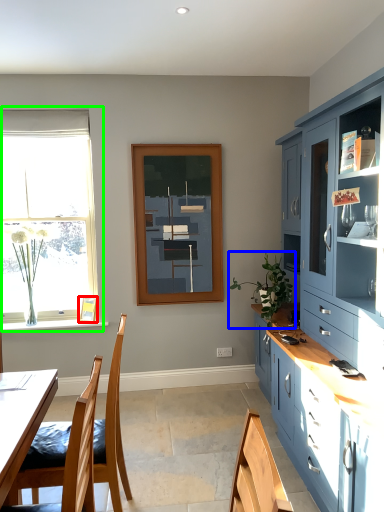
Question: Based on their relative distances, which object is farther from picture frame (highlighted by a red box)? Choose from houseplant (highlighted by a blue box) and window (highlighted by a green box).

Choices:
 (A) houseplant
 (B) window

Answer: (A)